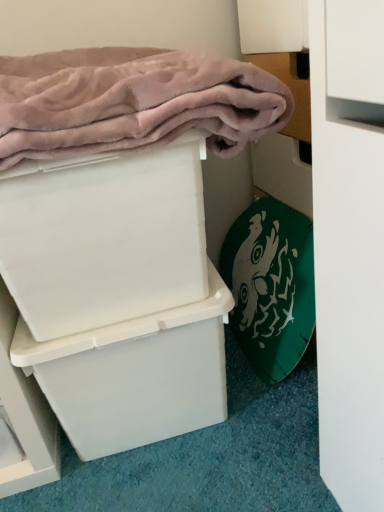
Question: Could you tell me if white plastic box at upper left, which is counted as the 2th box, starting from the bottom, is facing white plastic box at center, the second box viewed from the top?

Choices:
 (A) yes
 (B) no

Answer: (B)

Question: Is white plastic box at upper left, the first box in the top-to-bottom sequence, in front of white plastic box at center, the second box viewed from the top?

Choices:
 (A) no
 (B) yes

Answer: (B)

Question: From a real-world perspective, is white plastic box at upper left, which is counted as the 2th box, starting from the bottom, below white plastic box at center, the first box in the bottom-to-top sequence?

Choices:
 (A) no
 (B) yes

Answer: (A)

Question: Is white plastic box at upper left, the first box in the top-to-bottom sequence, surrounding white plastic box at center, the first box in the bottom-to-top sequence?

Choices:
 (A) no
 (B) yes

Answer: (A)

Question: Considering the relative sizes of white plastic box at upper left, the first box in the top-to-bottom sequence, and white plastic box at center, the first box in the bottom-to-top sequence, in the image provided, is white plastic box at upper left, the first box in the top-to-bottom sequence, bigger than white plastic box at center, the first box in the bottom-to-top sequence,?

Choices:
 (A) no
 (B) yes

Answer: (A)

Question: Is white plastic box at upper left, the first box in the top-to-bottom sequence, turned away from white plastic box at center, the first box in the bottom-to-top sequence?

Choices:
 (A) no
 (B) yes

Answer: (A)

Question: Is white plastic box at upper left, which is counted as the 2th box, starting from the bottom, placed right next to pink plush bath towel at upper left, which ranks as the first bath towel in top-to-bottom order?

Choices:
 (A) yes
 (B) no

Answer: (B)

Question: Can you confirm if white plastic box at upper left, the first box in the top-to-bottom sequence, is taller than pink plush bath towel at upper left, which is the first bath towel in left-to-right order?

Choices:
 (A) yes
 (B) no

Answer: (A)

Question: From the image's perspective, is white plastic box at upper left, which is counted as the 2th box, starting from the bottom, under pink plush bath towel at upper left, the 2th bath towel from the right?

Choices:
 (A) no
 (B) yes

Answer: (B)

Question: From the image's perspective, is white plastic box at upper left, the first box in the top-to-bottom sequence, over pink plush bath towel at upper left, the 2th bath towel from the right?

Choices:
 (A) no
 (B) yes

Answer: (A)

Question: Can you confirm if white plastic box at upper left, the first box in the top-to-bottom sequence, is shorter than pink plush bath towel at upper left, which is the first bath towel in left-to-right order?

Choices:
 (A) no
 (B) yes

Answer: (A)

Question: Is white plastic box at upper left, the first box in the top-to-bottom sequence, oriented towards pink plush bath towel at upper left, which appears as the 2th bath towel when ordered from the bottom?

Choices:
 (A) yes
 (B) no

Answer: (B)

Question: Does pink plush bath towel at upper left, the 2th bath towel from the right, turn towards green fabric bath towel at lower right, positioned as the second bath towel in top-to-bottom order?

Choices:
 (A) yes
 (B) no

Answer: (B)